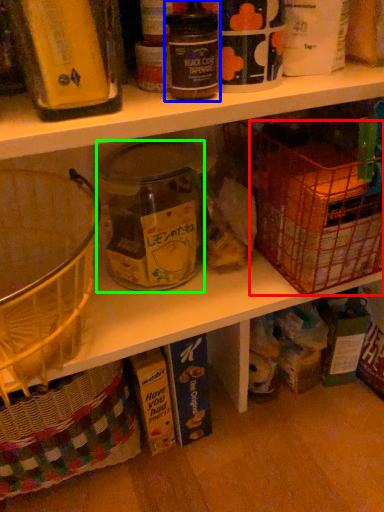
Question: Which object is the closest to the basket (highlighted by a red box)? Choose among these: bottle (highlighted by a blue box) or glass jar (highlighted by a green box).

Choices:
 (A) bottle
 (B) glass jar

Answer: (B)